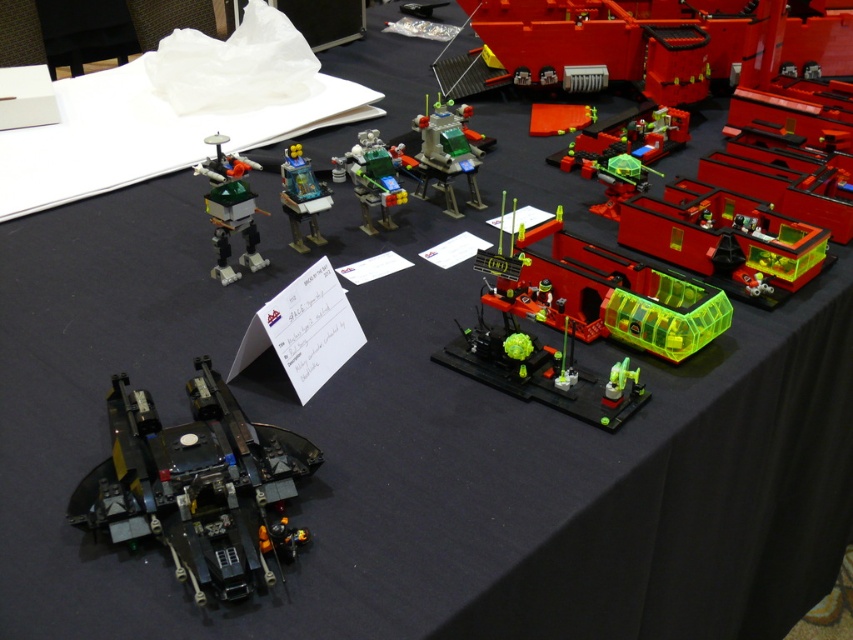
Question: Does translucent green plastic tank at upper right appear on the left side of rubik's cube plastic robot at center?

Choices:
 (A) no
 (B) yes

Answer: (A)

Question: Estimate the real-world distances between objects in this image. Which object is closer to the transparent plastic pod at center-right?

Choices:
 (A) translucent green plastic tank at upper right
 (B) black matte spaceship at lower left

Answer: (A)

Question: Which of these objects is positioned farthest from the rubik's cube plastic robot at center?

Choices:
 (A) black matte spaceship at lower left
 (B) transparent green plastic at center
 (C) transparent plastic pod at center-right
 (D) green plastic robot at center

Answer: (A)

Question: Which of the following is the farthest from the observer?

Choices:
 (A) transparent green plastic at center
 (B) translucent green plastic tank at upper right
 (C) translucent plastic figure at center
 (D) green plastic robot at center

Answer: (B)

Question: Is shiny green plastic robot at upper left thinner than translucent plastic figure at center?

Choices:
 (A) no
 (B) yes

Answer: (B)

Question: From the image, what is the correct spatial relationship of translucent green plastic tank at upper right in relation to shiny green plastic robot at upper left?

Choices:
 (A) below
 (B) above

Answer: (B)